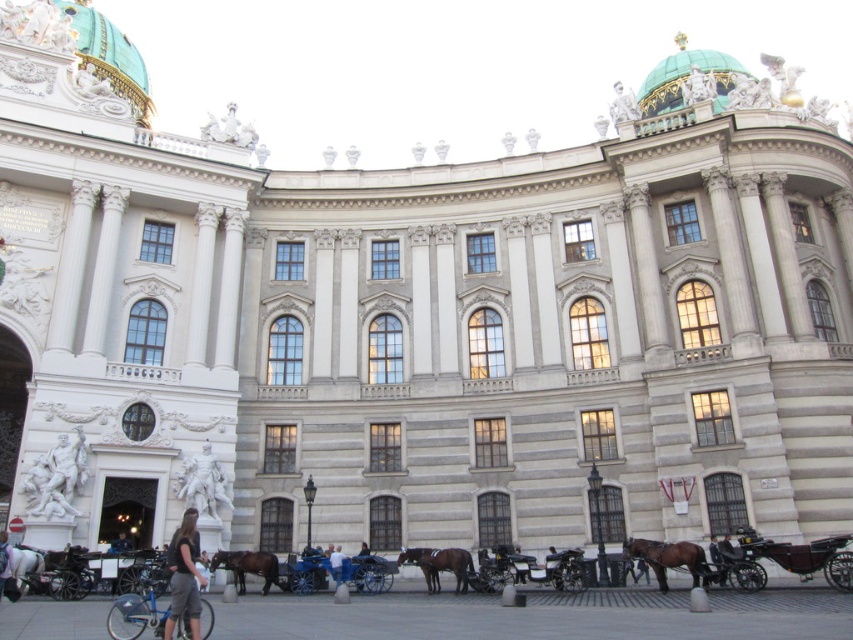
Which is more to the left, dark gray fabric pants at lower left or blue denim jeans at lower center?

dark gray fabric pants at lower left is more to the left.

Describe the element at coordinates (184, 577) in the screenshot. The width and height of the screenshot is (853, 640). I see `dark gray fabric pants at lower left` at that location.

Who is more forward, (190, 573) or (339, 566)?

Point (190, 573) is more forward.

Identify the location of dark gray fabric pants at lower left. The height and width of the screenshot is (640, 853). (184, 577).

Does dark gray fabric pants at lower left have a smaller size compared to brown glossy horse at lower right?

No, dark gray fabric pants at lower left is not smaller than brown glossy horse at lower right.

Find the location of a particular element. Image resolution: width=853 pixels, height=640 pixels. dark gray fabric pants at lower left is located at coordinates (184, 577).

Is blue denim jeans at lower center behind dark blue jeans at lower left?

Yes.

Is point (329, 570) in front of point (114, 552)?

No, it is behind (114, 552).

Identify the location of blue denim jeans at lower center. (335, 564).